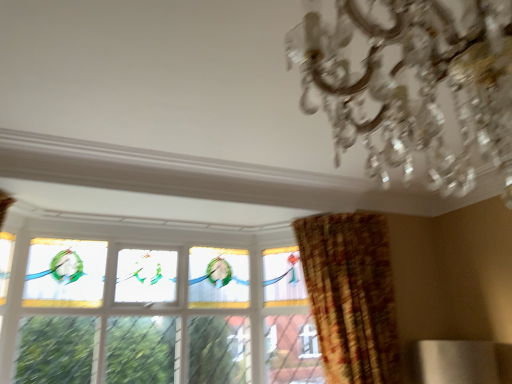
Identify the location of stained glass window at center. This screenshot has height=384, width=512. (158, 315).

Identify the location of window located on the left of plaid fabric curtain at right. (158, 315).

Is plaid fabric curtain at right taller or shorter than stained glass window at center?

Clearly, plaid fabric curtain at right is shorter compared to stained glass window at center.

Between point (348, 271) and point (233, 337), which one is positioned in front?

The point (348, 271) is closer to the camera.

How much distance is there between plaid fabric curtain at right and stained glass window at center?

plaid fabric curtain at right and stained glass window at center are 33.64 inches apart from each other.

Is clear crystal chandelier at upper right directly adjacent to stained glass window at center?

No, clear crystal chandelier at upper right is not beside stained glass window at center.

Which of these two, clear crystal chandelier at upper right or stained glass window at center, is wider?

clear crystal chandelier at upper right is wider.

Is point (371, 53) positioned in front of point (122, 272)?

That is True.

Is clear crystal chandelier at upper right not inside plaid fabric curtain at right?

Yes, clear crystal chandelier at upper right is not within plaid fabric curtain at right.

Considering the positions of objects clear crystal chandelier at upper right and plaid fabric curtain at right in the image provided, who is in front, clear crystal chandelier at upper right or plaid fabric curtain at right?

clear crystal chandelier at upper right is more forward.

Is clear crystal chandelier at upper right shorter than plaid fabric curtain at right?

Yes.

Is stained glass window at center smaller than clear crystal chandelier at upper right?

No.

Which is nearer, (288, 341) or (402, 125)?

Clearly, point (288, 341) is more distant from the camera than point (402, 125).

Locate an element on the screen. The image size is (512, 384). chandelier above the stained glass window at center (from the image's perspective) is located at coordinates (419, 88).

Is clear crystal chandelier at upper right surrounded by stained glass window at center?

Actually, clear crystal chandelier at upper right is outside stained glass window at center.

Is stained glass window at center outside of plaid fabric curtain at right?

Yes, stained glass window at center is outside of plaid fabric curtain at right.

Can you confirm if stained glass window at center is wider than plaid fabric curtain at right?

In fact, stained glass window at center might be narrower than plaid fabric curtain at right.

What's the angular difference between stained glass window at center and plaid fabric curtain at right's facing directions?

stained glass window at center and plaid fabric curtain at right are facing 102 degrees away from each other.

Is plaid fabric curtain at right closer to the viewer compared to clear crystal chandelier at upper right?

No, it is not.

Are plaid fabric curtain at right and clear crystal chandelier at upper right located far from each other?

Yes.

Would you say plaid fabric curtain at right is to the left or to the right of clear crystal chandelier at upper right in the picture?

In the image, plaid fabric curtain at right appears on the right side of clear crystal chandelier at upper right.

From a real-world perspective, which object rests below the other?

plaid fabric curtain at right is physically lower.

Identify the location of curtain above the stained glass window at center (from the image's perspective). (351, 295).

This screenshot has height=384, width=512. What are the coordinates of `window below the clear crystal chandelier at upper right (from a real-world perspective)` in the screenshot? It's located at 158,315.

Looking at the image, which one is located closer to plaid fabric curtain at right, clear crystal chandelier at upper right or stained glass window at center?

stained glass window at center is positioned closer to the anchor plaid fabric curtain at right.

When comparing their distances from stained glass window at center, does plaid fabric curtain at right or clear crystal chandelier at upper right seem further?

clear crystal chandelier at upper right is further to stained glass window at center.

From the picture: When comparing their distances from stained glass window at center, does clear crystal chandelier at upper right or plaid fabric curtain at right seem further?

clear crystal chandelier at upper right lies further to stained glass window at center than the other object.

When comparing their distances from clear crystal chandelier at upper right, does stained glass window at center or plaid fabric curtain at right seem further?

stained glass window at center is positioned further to the anchor clear crystal chandelier at upper right.

In the scene shown: When comparing their distances from clear crystal chandelier at upper right, does plaid fabric curtain at right or stained glass window at center seem further?

Based on the image, stained glass window at center appears to be further to clear crystal chandelier at upper right.

Estimate the real-world distances between objects in this image. Which object is closer to plaid fabric curtain at right, stained glass window at center or clear crystal chandelier at upper right?

stained glass window at center.

This screenshot has width=512, height=384. What are the coordinates of `curtain between clear crystal chandelier at upper right and stained glass window at center along the z-axis` in the screenshot? It's located at (351, 295).